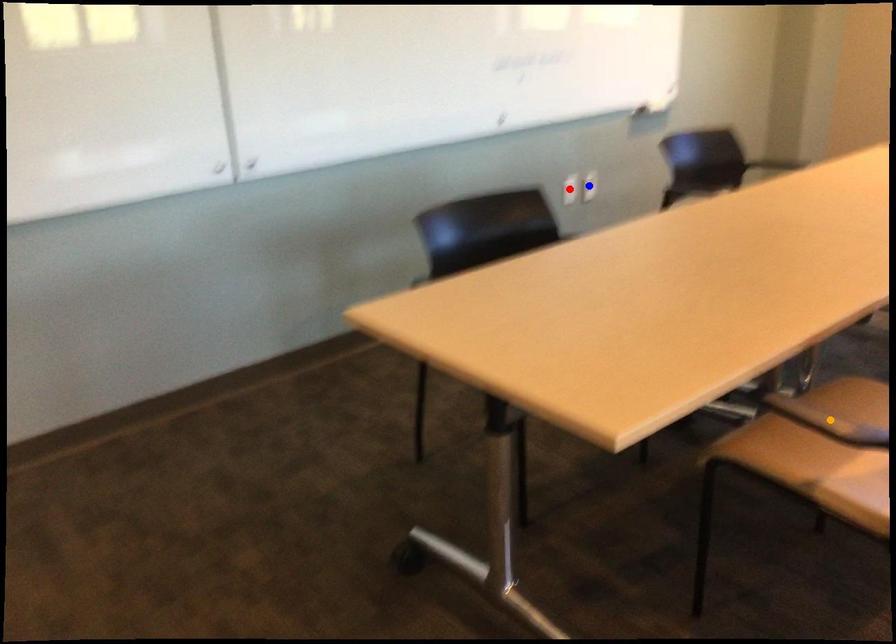
Order these from farthest to nearest:
1. red point
2. orange point
3. blue point

1. blue point
2. red point
3. orange point